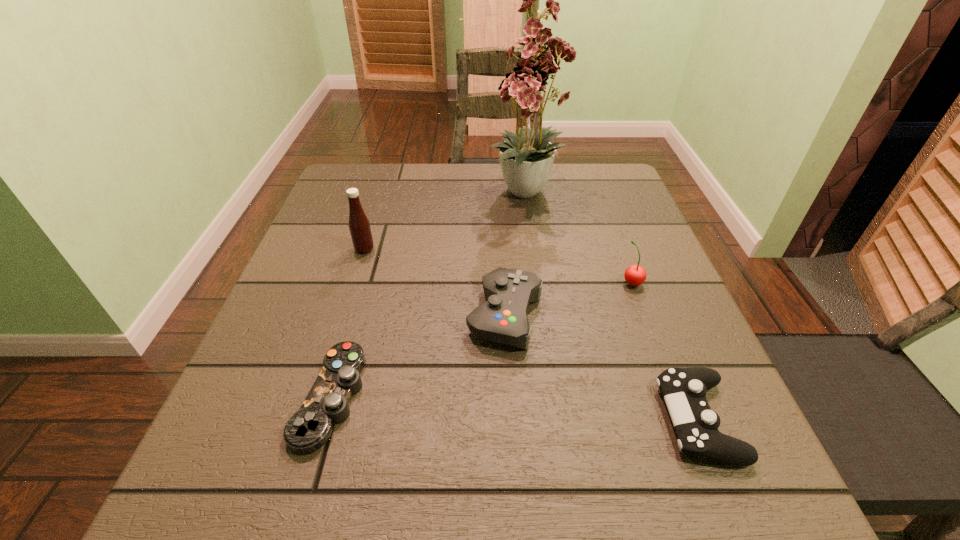
Locate an element on the screen. This screenshot has height=540, width=960. vacant space in between the tallest object and the shortest control is located at coordinates (429, 295).

You are a GUI agent. You are given a task and a screenshot of the screen. Output one action in this format:
    pyautogui.click(x=<x>, y=<y>)
    Task: Click on the free space between the farthest object and the shortest control
    The height and width of the screenshot is (540, 960).
    Given the screenshot: What is the action you would take?
    pyautogui.click(x=429, y=295)

Locate an element on the screen. This screenshot has width=960, height=540. object that stands as the third closest to the fourth shortest object is located at coordinates (684, 390).

Image resolution: width=960 pixels, height=540 pixels. I want to click on object that stands as the fourth closest to the fifth shortest object, so [635, 275].

Where is `control that stands as the second closest to the shortest object`? The width and height of the screenshot is (960, 540). control that stands as the second closest to the shortest object is located at coordinates [684, 390].

Locate an element on the screen. control that is the closest one to the cherry is located at coordinates (503, 319).

Image resolution: width=960 pixels, height=540 pixels. Find the location of `vacant space that satisfies the following two spatial constraints: 1. on the back side of the tallest control; 2. on the right side of the cherry`. vacant space that satisfies the following two spatial constraints: 1. on the back side of the tallest control; 2. on the right side of the cherry is located at coordinates (503, 282).

Find the location of a particular element. vacant position in the image that satisfies the following two spatial constraints: 1. on the back side of the leftmost control; 2. on the right side of the fourth shortest object is located at coordinates (364, 282).